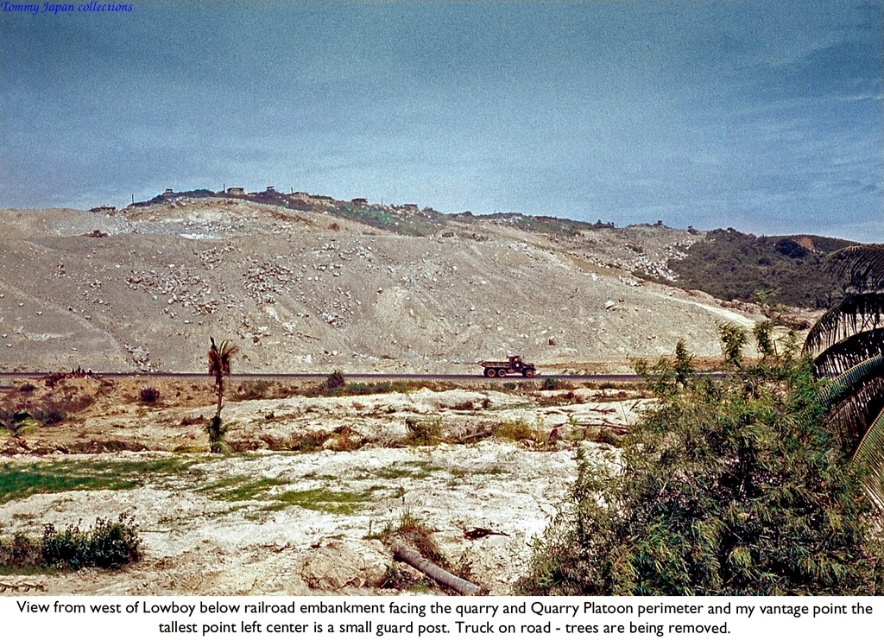
Does dull gray rock at center have a greater width compared to brown dirt road at center?

Correct, the width of dull gray rock at center exceeds that of brown dirt road at center.

Consider the image. Is dull gray rock at center closer to the viewer compared to brown dirt road at center?

No, dull gray rock at center is behind brown dirt road at center.

Between point (105, 285) and point (465, 376), which one is positioned behind?

The point (105, 285) is more distant.

Where is `dull gray rock at center`? dull gray rock at center is located at coordinates (332, 291).